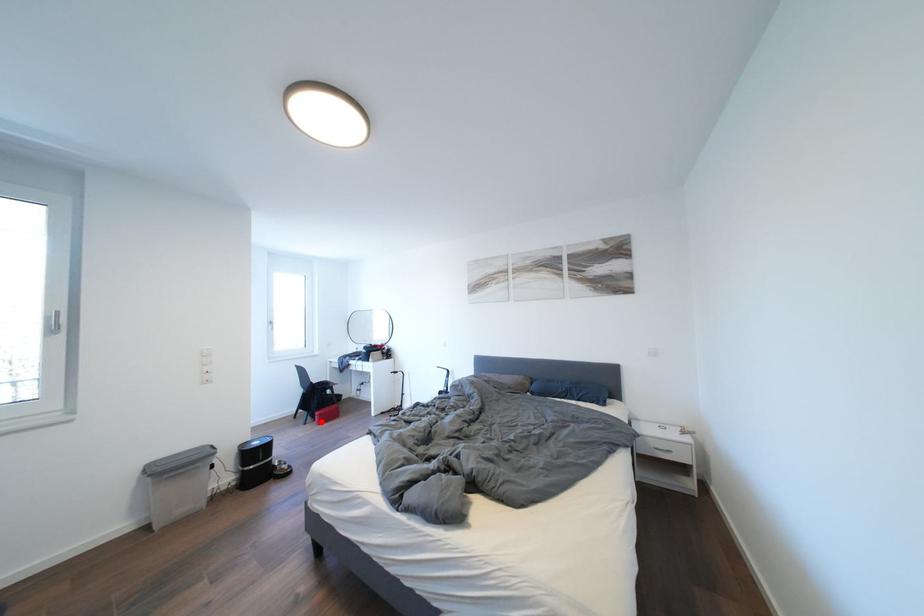
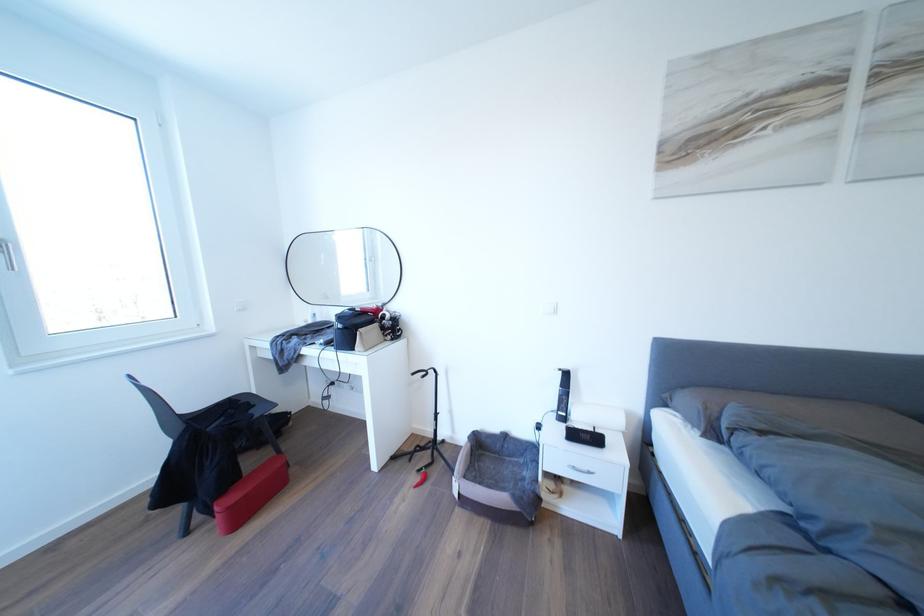
The point at the highlighted location is marked in the first image. Where is the corresponding point in the second image?

(217, 519)